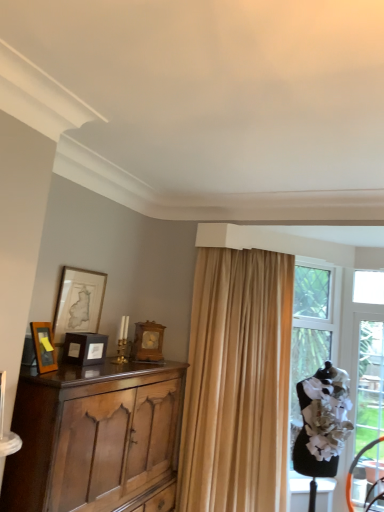
Question: Is the surface of polished wood cabinet at left in direct contact with matte gold picture frame at upper left, the third picture frame viewed from the front?

Choices:
 (A) no
 (B) yes

Answer: (A)

Question: Can you confirm if polished wood cabinet at left is positioned to the right of matte gold picture frame at upper left, the second picture frame viewed from the back?

Choices:
 (A) no
 (B) yes

Answer: (B)

Question: Is polished wood cabinet at left facing away from matte gold picture frame at upper left, the second picture frame viewed from the back?

Choices:
 (A) yes
 (B) no

Answer: (B)

Question: Would you say polished wood cabinet at left is outside matte gold picture frame at upper left, the second picture frame viewed from the back?

Choices:
 (A) yes
 (B) no

Answer: (A)

Question: From the image's perspective, is polished wood cabinet at left below matte gold picture frame at upper left, the second picture frame viewed from the back?

Choices:
 (A) yes
 (B) no

Answer: (A)

Question: Is matte wooden picture frame at left, marked as the first picture frame in a front-to-back arrangement, inside the boundaries of beige fabric curtain at center, or outside?

Choices:
 (A) outside
 (B) inside

Answer: (A)

Question: Does point (39, 322) appear closer or farther from the camera than point (261, 451)?

Choices:
 (A) farther
 (B) closer

Answer: (B)

Question: In the image, is matte wooden picture frame at left, which is the fourth picture frame in back-to-front order, on the left side or the right side of beige fabric curtain at center?

Choices:
 (A) left
 (B) right

Answer: (A)

Question: From a real-world perspective, is matte wooden picture frame at left, marked as the first picture frame in a front-to-back arrangement, physically located above or below beige fabric curtain at center?

Choices:
 (A) above
 (B) below

Answer: (A)

Question: Is clear glass door at right bigger or smaller than matte gold picture frame at upper left, the third picture frame viewed from the front?

Choices:
 (A) small
 (B) big

Answer: (B)

Question: In terms of width, does clear glass door at right look wider or thinner when compared to matte gold picture frame at upper left, the second picture frame viewed from the back?

Choices:
 (A) wide
 (B) thin

Answer: (B)

Question: In the image, is clear glass door at right on the left side or the right side of matte gold picture frame at upper left, the third picture frame viewed from the front?

Choices:
 (A) left
 (B) right

Answer: (B)

Question: Considering the positions of clear glass door at right and matte gold picture frame at upper left, the second picture frame viewed from the back, in the image, is clear glass door at right taller or shorter than matte gold picture frame at upper left, the second picture frame viewed from the back,?

Choices:
 (A) tall
 (B) short

Answer: (A)

Question: Choose the correct answer: Is wooden clock at center, arranged as the first picture frame when viewed from the back, inside polished wood cabinet at left or outside it?

Choices:
 (A) inside
 (B) outside

Answer: (B)

Question: From a real-world perspective, relative to polished wood cabinet at left, is wooden clock at center, arranged as the first picture frame when viewed from the back, vertically above or below?

Choices:
 (A) above
 (B) below

Answer: (A)